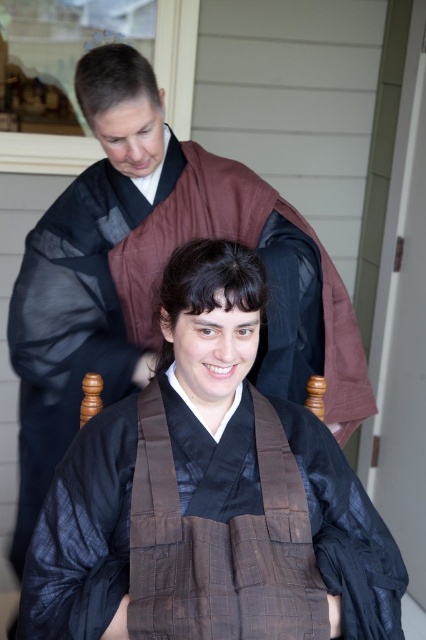
Can you confirm if brown quilted fabric robe at center is wider than brown silk kimono at center?

In fact, brown quilted fabric robe at center might be narrower than brown silk kimono at center.

Is brown quilted fabric robe at center bigger than brown silk kimono at center?

No, brown quilted fabric robe at center is not bigger than brown silk kimono at center.

Locate an element on the screen. The width and height of the screenshot is (426, 640). brown quilted fabric robe at center is located at coordinates pos(209,529).